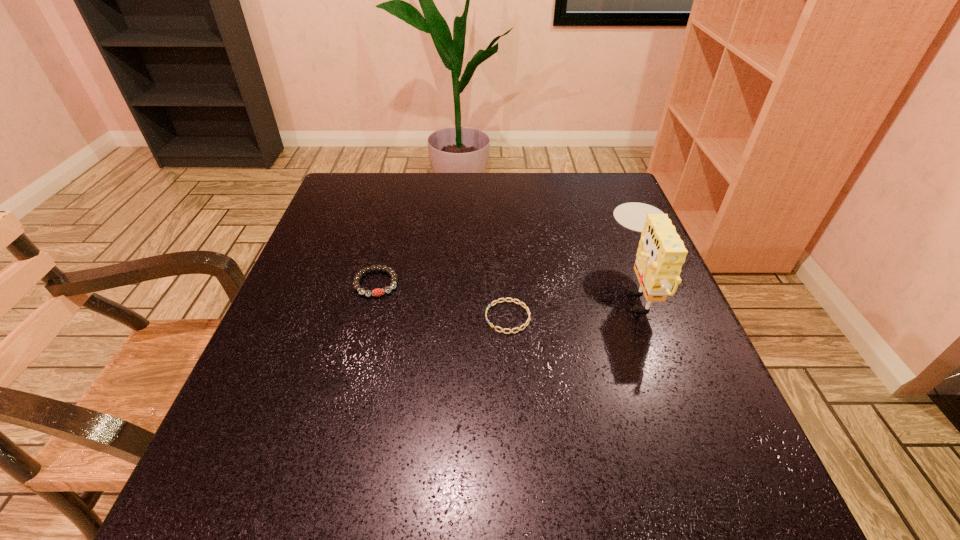
I want to click on vacant region located 0.400m on the surface of the shortest object showing star-shaped elements, so click(x=282, y=317).

At what (x,y) coordinates should I click in order to perform the action: click on vacant region located on the surface of the shortest object showing star-shaped elements. Please return your answer as a coordinate pair (x, y). Looking at the image, I should click on (424, 317).

I want to click on free space located 0.190m on the surface of the shortest object showing star-shaped elements, so click(389, 317).

Find the location of `object at the left edge`. object at the left edge is located at coordinates (377, 292).

You are a GUI agent. You are given a task and a screenshot of the screen. Output one action in this format:
    pyautogui.click(x=<x>, y=<y>)
    Task: Click on the object situated at the right edge
    
    Given the screenshot: What is the action you would take?
    pyautogui.click(x=661, y=253)

Where is `free spot at the far edge of the desktop`? Image resolution: width=960 pixels, height=540 pixels. free spot at the far edge of the desktop is located at coordinates (534, 188).

Find the location of `vacant position at the near edge of the desktop`. vacant position at the near edge of the desktop is located at coordinates (487, 489).

Identify the location of free region at the left edge of the desktop. (278, 350).

I want to click on free space at the right edge of the desktop, so click(616, 326).

Find the location of a particular element. This screenshot has height=540, width=960. vacant region at the far left corner of the desktop is located at coordinates (368, 215).